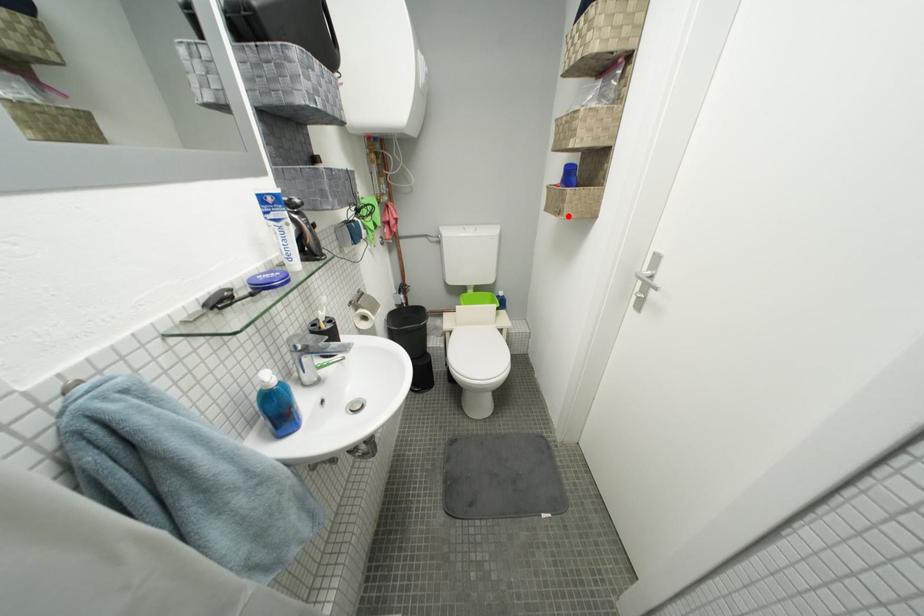
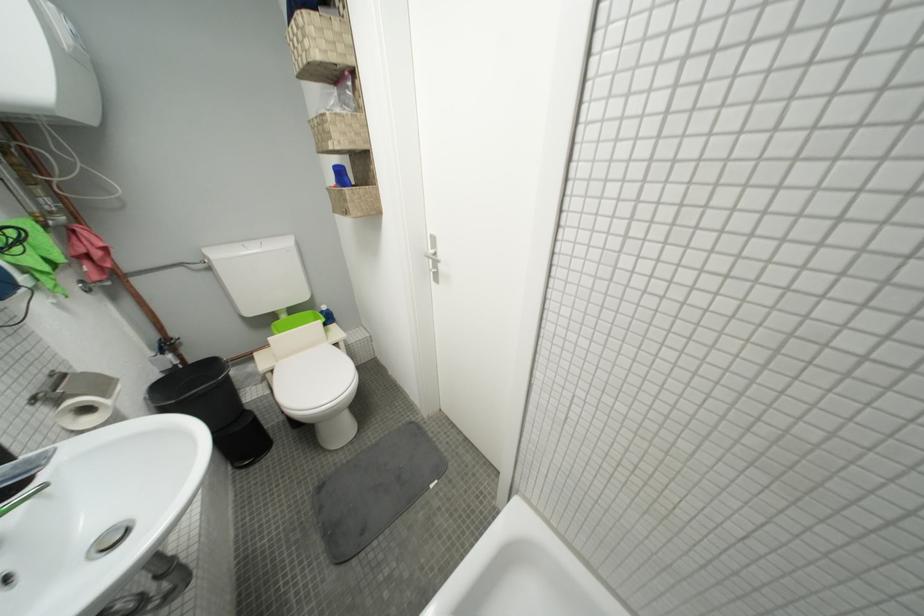
In the second image, find the point that corresponds to the highlighted location in the first image.

(354, 216)